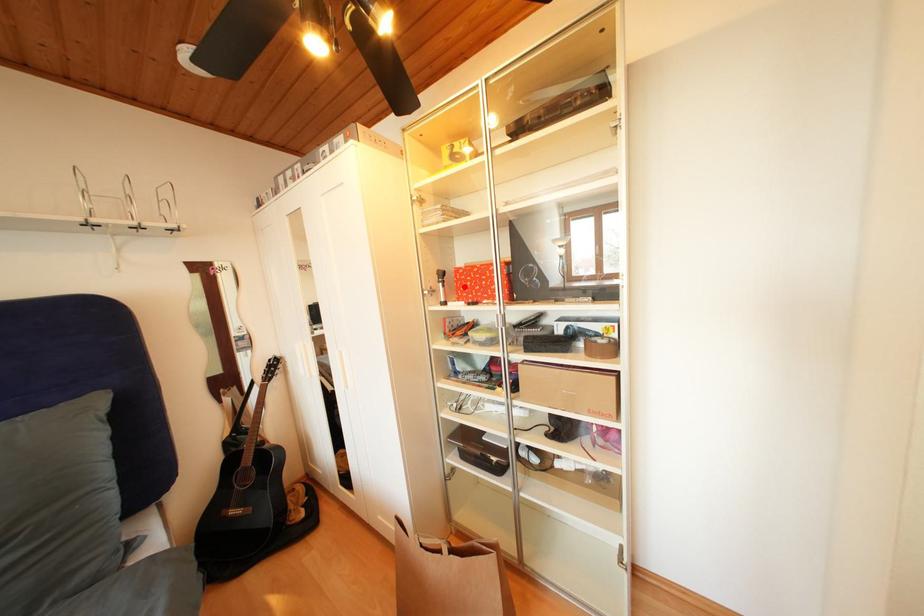
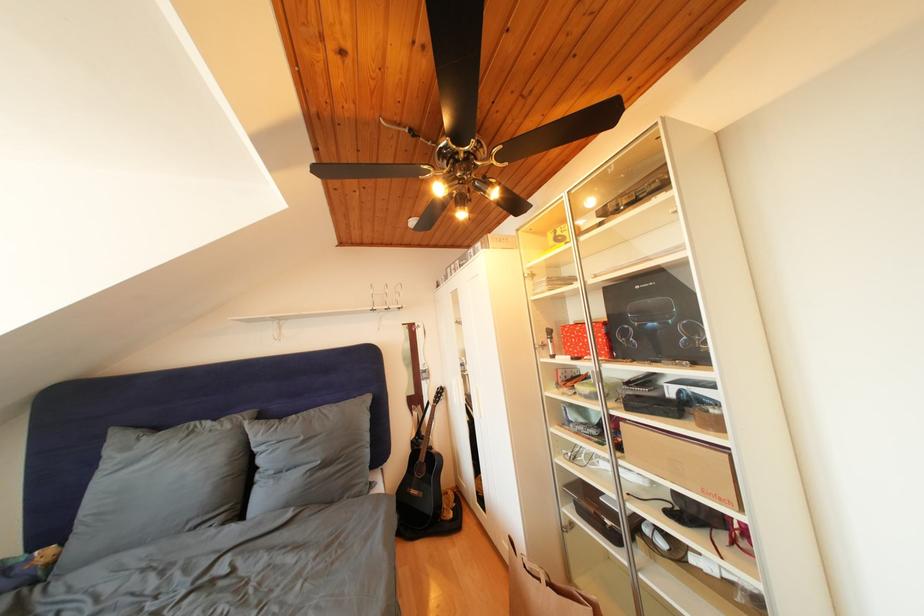
Where in the second image is the point corresponding to the highlighted location from the first image?

(572, 342)